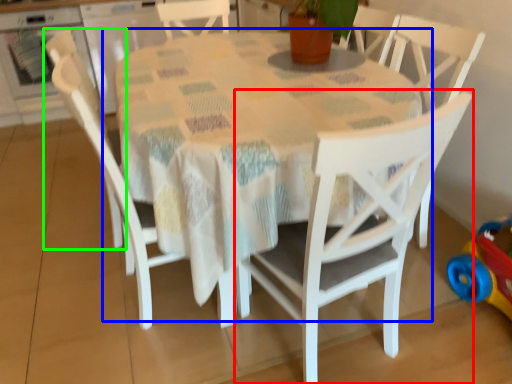
Question: Considering the real-world distances, which object is closest to chair (highlighted by a red box)? table (highlighted by a blue box) or chair (highlighted by a green box).

Choices:
 (A) table
 (B) chair

Answer: (A)